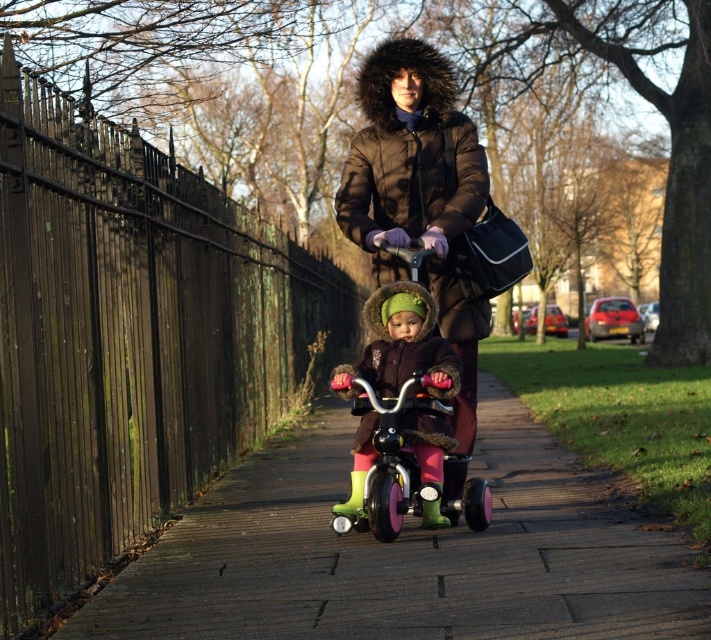
Who is more distant from viewer, (447,67) or (348,397)?

Positioned behind is point (447,67).

Between dark brown quilted jacket at center and matte pink tricycle at center, which one appears on the left side from the viewer's perspective?

matte pink tricycle at center is more to the left.

Which is in front, point (351, 150) or point (373, 429)?

Point (373, 429) is in front.

Where is `dark brown quilted jacket at center`? dark brown quilted jacket at center is located at coordinates (419, 200).

Does dark brown wooden fence at left have a larger size compared to pink rubber tricycle at center?

Yes.

Does dark brown wooden fence at left appear under pink rubber tricycle at center?

Incorrect, dark brown wooden fence at left is not positioned below pink rubber tricycle at center.

This screenshot has height=640, width=711. Find the location of `dark brown wooden fence at left`. dark brown wooden fence at left is located at coordinates (132, 339).

This screenshot has width=711, height=640. In order to click on dark brown wooden fence at left in this screenshot , I will do `click(132, 339)`.

Does dark brown wooden fence at left have a lesser height compared to matte pink tricycle at center?

In fact, dark brown wooden fence at left may be taller than matte pink tricycle at center.

Is point (9, 115) closer to viewer compared to point (410, 307)?

Yes, point (9, 115) is closer to viewer.

Image resolution: width=711 pixels, height=640 pixels. Identify the location of dark brown wooden fence at left. (132, 339).